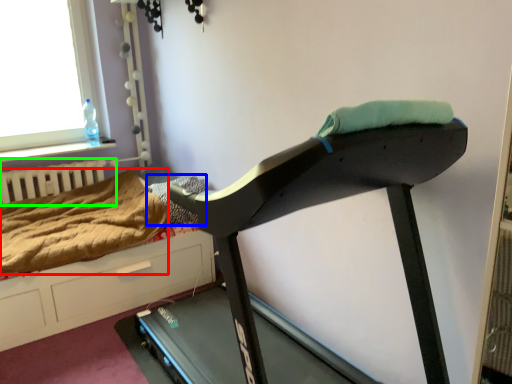
Question: Which object is positioned farthest from blanket (highlighted by a red box)? Select from blanket (highlighted by a blue box) and radiator (highlighted by a green box).

Choices:
 (A) blanket
 (B) radiator

Answer: (A)